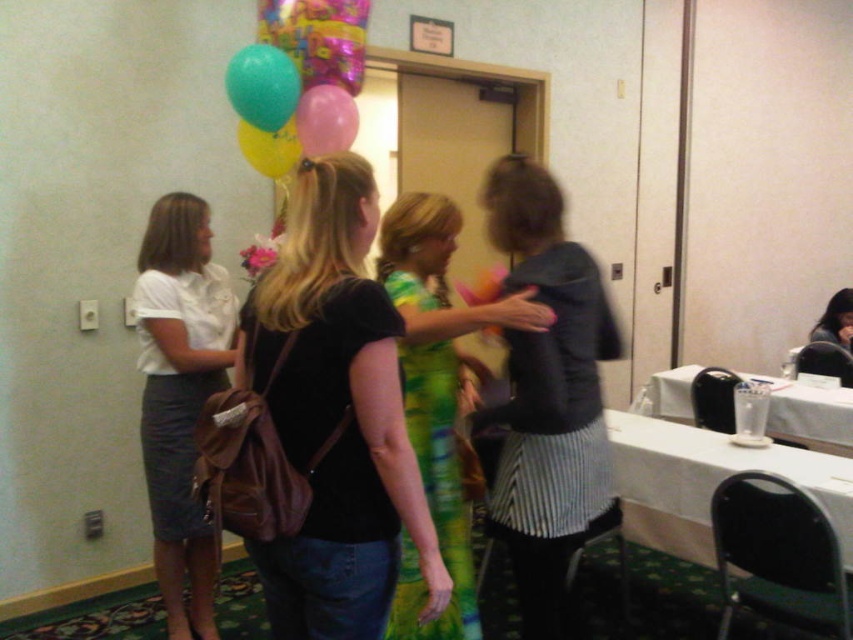
Question: Among these objects, which one is nearest to the camera?

Choices:
 (A) translucent rubber balloon at upper left
 (B) green textured dress at center
 (C) white matte skirt at left
 (D) black matte backpack at center

Answer: (D)

Question: Can you confirm if white plastic table at lower right is thinner than translucent rubber balloon at upper left?

Choices:
 (A) no
 (B) yes

Answer: (A)

Question: In this image, where is pink rubber balloon at center located relative to smooth black hair at center?

Choices:
 (A) left
 (B) right

Answer: (A)

Question: Considering the real-world distances, which object is farthest from the translucent rubber balloon at upper left?

Choices:
 (A) black matte backpack at center
 (B) pink rubber balloon at center
 (C) white matte skirt at left

Answer: (A)

Question: Among these objects, which one is farthest from the camera?

Choices:
 (A) yellow paper balloon at upper center
 (B) translucent rubber balloon at upper left

Answer: (A)

Question: Where is white matte skirt at left located in relation to smooth black hair at center in the image?

Choices:
 (A) below
 (B) above

Answer: (A)